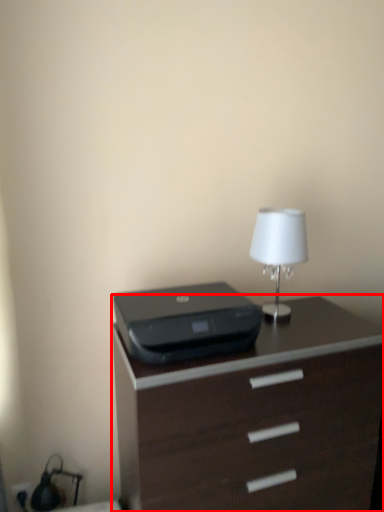
Question: From the image's perspective, where is chest of drawers (annotated by the red box) located relative to printer?

Choices:
 (A) below
 (B) above

Answer: (A)